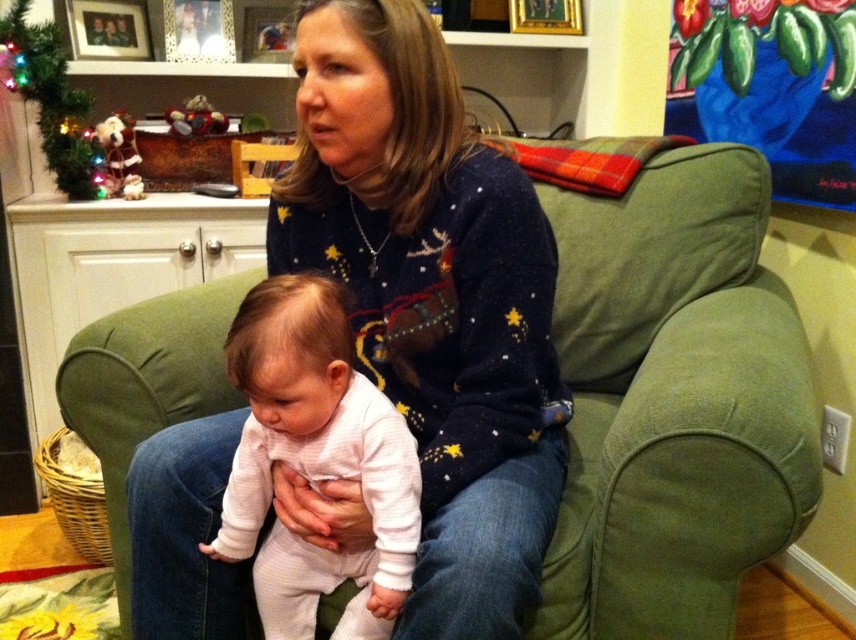
Does green fabric couch at center come behind green artificial christmas tree at upper left?

No, it is in front of green artificial christmas tree at upper left.

In the scene shown: Between green fabric couch at center and green artificial christmas tree at upper left, which one appears on the right side from the viewer's perspective?

green fabric couch at center

Between point (107, 396) and point (92, 163), which one is positioned behind?

The point (92, 163) is more distant.

Identify the location of green fabric couch at center. Image resolution: width=856 pixels, height=640 pixels. (675, 401).

Is navy sweater at center in front of white soft onesie at center?

Yes.

Does navy sweater at center appear on the right side of white soft onesie at center?

Indeed, navy sweater at center is positioned on the right side of white soft onesie at center.

Find the location of a particular element. Image resolution: width=856 pixels, height=640 pixels. navy sweater at center is located at coordinates (432, 300).

This screenshot has width=856, height=640. Identify the location of navy sweater at center. (432, 300).

Looking at this image, who is higher up, white soft onesie at center or green artificial christmas tree at upper left?

green artificial christmas tree at upper left is above.

From the picture: Can you confirm if white soft onesie at center is shorter than green artificial christmas tree at upper left?

In fact, white soft onesie at center may be taller than green artificial christmas tree at upper left.

Locate an element on the screen. white soft onesie at center is located at coordinates pyautogui.click(x=314, y=460).

Identify the location of white soft onesie at center. (314, 460).